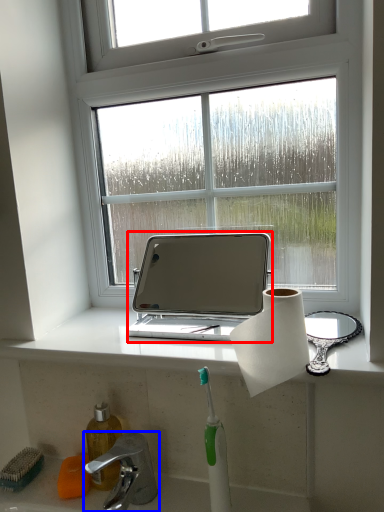
Question: Which point is further to the camera, laptop (highlighted by a red box) or tap (highlighted by a blue box)?

Choices:
 (A) laptop
 (B) tap

Answer: (A)